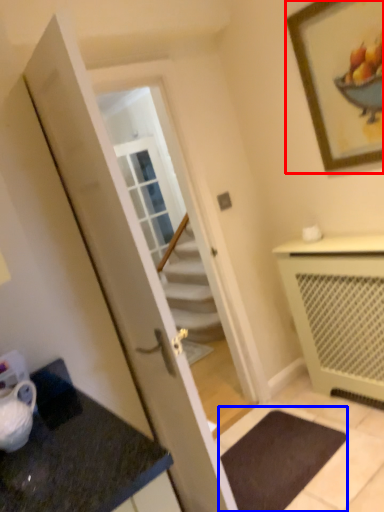
Question: Among these objects, which one is farthest to the camera, picture frame (highlighted by a red box) or bath mat (highlighted by a blue box)?

Choices:
 (A) picture frame
 (B) bath mat

Answer: (B)